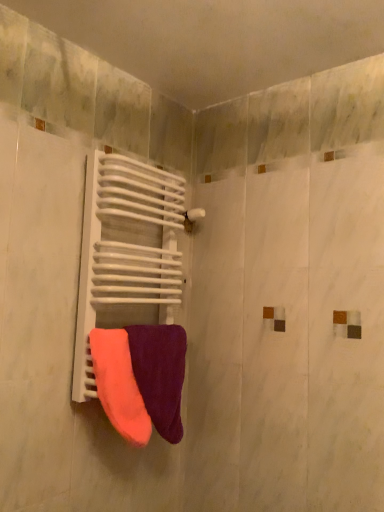
Question: Is neon orange fabric towel at center, positioned as the first towel in left-to-right order, thinner than white matte radiator at center?

Choices:
 (A) no
 (B) yes

Answer: (B)

Question: Is white matte radiator at center completely or partially inside neon orange fabric towel at center, the 2th towel from the right?

Choices:
 (A) yes
 (B) no

Answer: (B)

Question: Is neon orange fabric towel at center, positioned as the first towel in left-to-right order, turned away from white matte radiator at center?

Choices:
 (A) no
 (B) yes

Answer: (B)

Question: From a real-world perspective, is neon orange fabric towel at center, the 2th towel from the right, over white matte radiator at center?

Choices:
 (A) no
 (B) yes

Answer: (A)

Question: From the image's perspective, is neon orange fabric towel at center, the 2th towel from the right, beneath white matte radiator at center?

Choices:
 (A) yes
 (B) no

Answer: (A)

Question: In terms of height, does velvet purple towel at center, which appears as the second towel when viewed from the left, look taller or shorter compared to white matte radiator at center?

Choices:
 (A) tall
 (B) short

Answer: (B)

Question: In terms of size, does velvet purple towel at center, which appears as the second towel when viewed from the left, appear bigger or smaller than white matte radiator at center?

Choices:
 (A) small
 (B) big

Answer: (A)

Question: From the image's perspective, is velvet purple towel at center, which appears as the second towel when viewed from the left, located above or below white matte radiator at center?

Choices:
 (A) above
 (B) below

Answer: (B)

Question: Looking at their shapes, would you say velvet purple towel at center, which appears as the second towel when viewed from the left, is wider or thinner than white matte radiator at center?

Choices:
 (A) wide
 (B) thin

Answer: (B)

Question: In terms of width, does white matte radiator at center look wider or thinner when compared to neon orange fabric towel at center, the 2th towel from the right?

Choices:
 (A) wide
 (B) thin

Answer: (A)

Question: Visually, is white matte radiator at center positioned to the left or to the right of neon orange fabric towel at center, the 2th towel from the right?

Choices:
 (A) right
 (B) left

Answer: (A)

Question: Is point (137, 196) closer or farther from the camera than point (129, 417)?

Choices:
 (A) farther
 (B) closer

Answer: (A)

Question: Would you say white matte radiator at center is inside or outside neon orange fabric towel at center, the 2th towel from the right?

Choices:
 (A) outside
 (B) inside

Answer: (A)

Question: Is velvet purple towel at center, which appears as the second towel when viewed from the left, in front of or behind neon orange fabric towel at center, positioned as the first towel in left-to-right order, in the image?

Choices:
 (A) front
 (B) behind

Answer: (B)

Question: Is point (162, 359) positioned closer to the camera than point (97, 337)?

Choices:
 (A) farther
 (B) closer

Answer: (A)